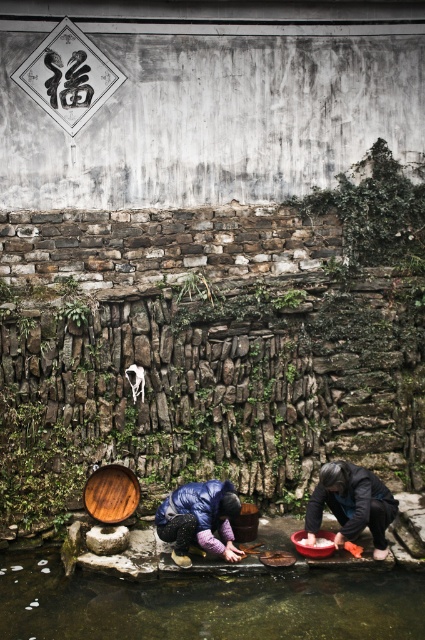
Question: Does dark gray fabric at lower right have a larger size compared to purple down jacket at lower center?

Choices:
 (A) no
 (B) yes

Answer: (B)

Question: Does clear water at lower center have a lesser width compared to dark gray fabric at lower right?

Choices:
 (A) yes
 (B) no

Answer: (B)

Question: Which of the following is the closest to the observer?

Choices:
 (A) clear water at lower center
 (B) dark gray fabric at lower right

Answer: (A)

Question: Which object is positioned farthest from the clear water at lower center?

Choices:
 (A) purple down jacket at lower center
 (B) dark gray fabric at lower right

Answer: (B)

Question: Among these points, which one is nearest to the camera?

Choices:
 (A) (218, 529)
 (B) (353, 474)
 (C) (240, 588)

Answer: (C)

Question: Where is clear water at lower center located in relation to purple down jacket at lower center in the image?

Choices:
 (A) right
 (B) left

Answer: (B)